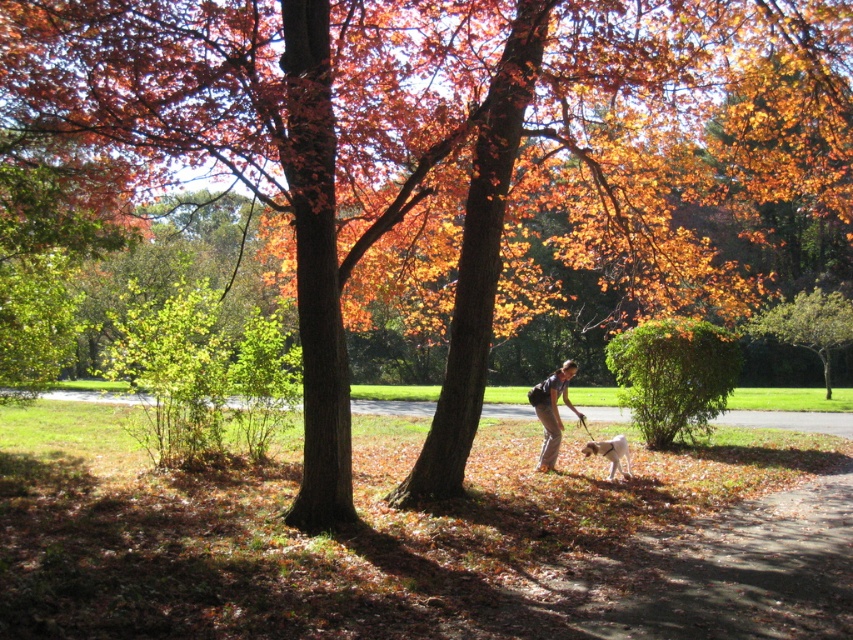
You are standing at the center of the park and want to find the green leafy tree at center. According to the coordinates provided, where should you look to locate it?

The green leafy tree at center is located at coordinates point [808,324].

You are standing at the origin point in the autumn park scene. You want to reach the green leafy bush at center. Which direction should you walk to get there?

The green leafy bush at center is located at coordinates point (672, 376), so you should walk towards the direction of the center to reach it.

Based on the photo, you are standing in the park and see the green leafy bush at center and the green leafy tree at center. Which one is wider?

The green leafy bush at center is less wide than the green leafy tree at center, so the green leafy tree at center is wider.